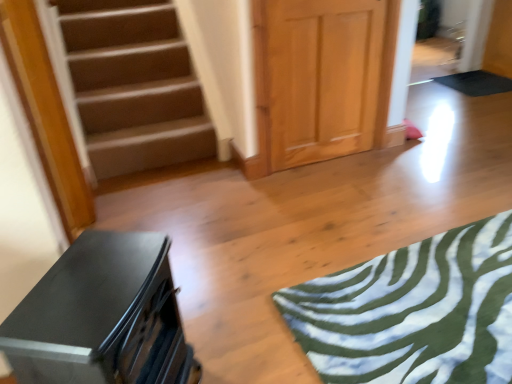
Identify the location of free space that is in between light wood paneling at center and green fabric yoga mat at lower right, which is the second yoga mat in back-to-front order. (365, 204).